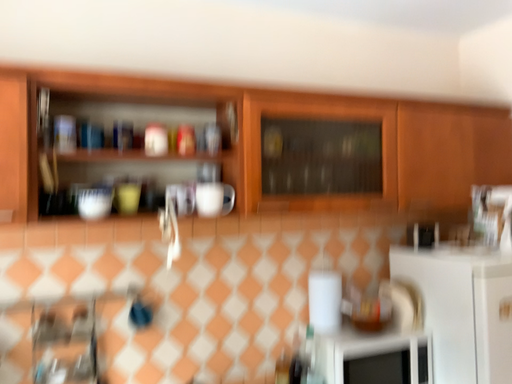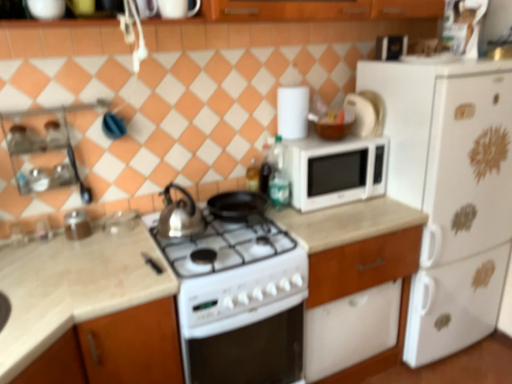
Question: How did the camera likely rotate when shooting the video?

Choices:
 (A) rotated downward
 (B) rotated upward

Answer: (A)